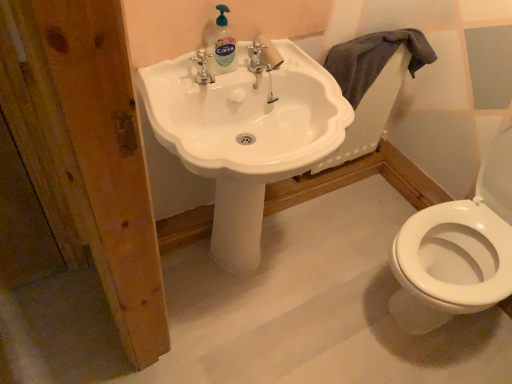
Describe the element at coordinates (221, 45) in the screenshot. I see `clear plastic bottle at upper center` at that location.

Find the location of `gray cotton towel at upper right`. gray cotton towel at upper right is located at coordinates (374, 59).

How many degrees apart are the facing directions of clear plastic bottle at upper center and gray cotton towel at upper right?

clear plastic bottle at upper center and gray cotton towel at upper right are facing 0.0111 degrees away from each other.

Locate an element on the screen. bath towel below the clear plastic bottle at upper center (from the image's perspective) is located at coordinates (374, 59).

Who is smaller, clear plastic bottle at upper center or gray cotton towel at upper right?

Smaller between the two is clear plastic bottle at upper center.

Choose the correct answer: Is clear plastic bottle at upper center inside gray cotton towel at upper right or outside it?

clear plastic bottle at upper center is outside gray cotton towel at upper right.

Is white glossy sink at center wider or thinner than gray cotton towel at upper right?

Clearly, white glossy sink at center has more width compared to gray cotton towel at upper right.

Would you say white glossy sink at center is outside gray cotton towel at upper right?

white glossy sink at center lies outside gray cotton towel at upper right's area.

Which is less distant, (x=184, y=153) or (x=413, y=67)?

The point (x=184, y=153) is closer to the camera.

Who is shorter, white glossy sink at center or gray cotton towel at upper right?

With less height is gray cotton towel at upper right.

Considering the positions of objects clear plastic bottle at upper center and white glossy sink at center in the image provided, who is more to the left, clear plastic bottle at upper center or white glossy sink at center?

Positioned to the left is clear plastic bottle at upper center.

From the image's perspective, which is below, clear plastic bottle at upper center or white glossy sink at center?

From the image's view, white glossy sink at center is below.

Looking at this image, considering the sizes of objects clear plastic bottle at upper center and white glossy sink at center in the image provided, who is smaller, clear plastic bottle at upper center or white glossy sink at center?

clear plastic bottle at upper center.

How different are the orientations of clear plastic bottle at upper center and white glossy sink at center in degrees?

They differ by 0.00515 degrees in their facing directions.

Is gray cotton towel at upper right with clear plastic bottle at upper center?

No, gray cotton towel at upper right is not in contact with clear plastic bottle at upper center.

From the image's perspective, is gray cotton towel at upper right above or below clear plastic bottle at upper center?

From the image's perspective, gray cotton towel at upper right appears below clear plastic bottle at upper center.

Does gray cotton towel at upper right appear on the right side of clear plastic bottle at upper center?

Indeed, gray cotton towel at upper right is positioned on the right side of clear plastic bottle at upper center.

Between gray cotton towel at upper right and clear plastic bottle at upper center, which one has less height?

With less height is clear plastic bottle at upper center.

Between white glossy sink at center and clear plastic bottle at upper center, which one has more height?

white glossy sink at center.

Is white glossy sink at center oriented away from clear plastic bottle at upper center?

No, clear plastic bottle at upper center is not at the back of white glossy sink at center.

Which is more to the left, white glossy sink at center or clear plastic bottle at upper center?

Positioned to the left is clear plastic bottle at upper center.

From the picture: Who is bigger, white glossy sink at center or clear plastic bottle at upper center?

white glossy sink at center is bigger.

Is point (371, 59) positioned before point (166, 64)?

No, it is behind (166, 64).

From a real-world perspective, is gray cotton towel at upper right physically located above or below white glossy sink at center?

From a real-world perspective, gray cotton towel at upper right is physically above white glossy sink at center.

Looking at this image, can you see gray cotton towel at upper right touching white glossy sink at center?

There is a gap between gray cotton towel at upper right and white glossy sink at center.

Where is `bath towel on the right of clear plastic bottle at upper center`? This screenshot has width=512, height=384. bath towel on the right of clear plastic bottle at upper center is located at coordinates (374, 59).

You are a GUI agent. You are given a task and a screenshot of the screen. Output one action in this format:
    pyautogui.click(x=<x>, y=<y>)
    Task: Click on the sink on the left side of gray cotton towel at upper right
    This screenshot has height=384, width=512.
    Given the screenshot: What is the action you would take?
    pyautogui.click(x=245, y=135)

When comparing their distances from white glossy sink at center, does clear plastic bottle at upper center or gray cotton towel at upper right seem closer?

clear plastic bottle at upper center is positioned closer to the anchor white glossy sink at center.

Looking at this image, when comparing their distances from gray cotton towel at upper right, does white glossy sink at center or clear plastic bottle at upper center seem closer?

Among the two, white glossy sink at center is located nearer to gray cotton towel at upper right.

Looking at the image, which one is located closer to clear plastic bottle at upper center, white glossy sink at center or gray cotton towel at upper right?

Among the two, white glossy sink at center is located nearer to clear plastic bottle at upper center.

From the image, which object appears to be nearer to gray cotton towel at upper right, clear plastic bottle at upper center or white glossy sink at center?

Based on the image, white glossy sink at center appears to be nearer to gray cotton towel at upper right.

Looking at the image, which one is located further to white glossy sink at center, gray cotton towel at upper right or clear plastic bottle at upper center?

A: gray cotton towel at upper right lies further to white glossy sink at center than the other object.

Based on their spatial positions, is gray cotton towel at upper right or white glossy sink at center closer to clear plastic bottle at upper center?

The object closer to clear plastic bottle at upper center is white glossy sink at center.

At what (x,y) coordinates should I click in order to perform the action: click on sink situated between clear plastic bottle at upper center and gray cotton towel at upper right from left to right. Please return your answer as a coordinate pair (x, y). The width and height of the screenshot is (512, 384). Looking at the image, I should click on (245, 135).